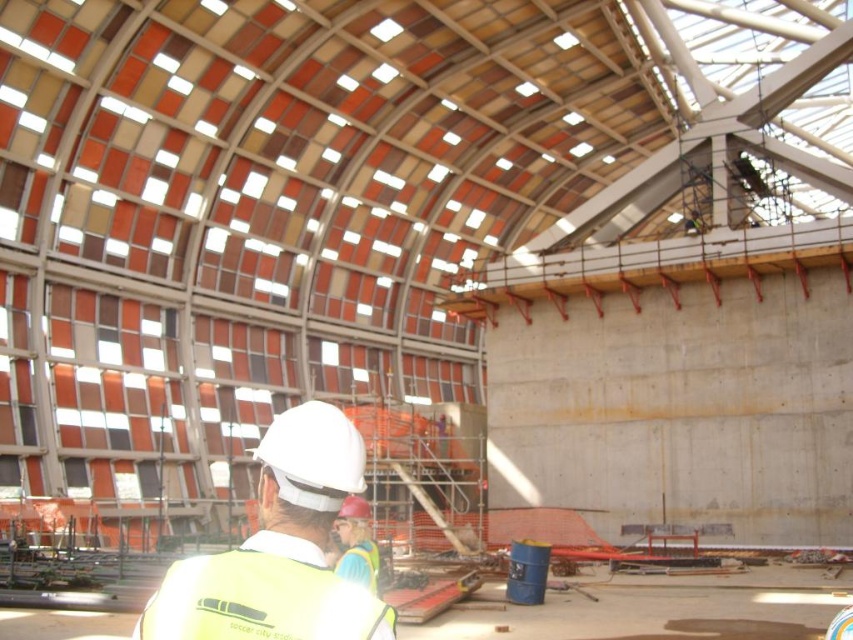
Who is lower down, yellow reflective vest at center or yellow reflective safety vest at lower left?

yellow reflective safety vest at lower left is lower down.

What do you see at coordinates (279, 548) in the screenshot? I see `yellow reflective vest at center` at bounding box center [279, 548].

The height and width of the screenshot is (640, 853). I want to click on yellow reflective vest at center, so click(x=279, y=548).